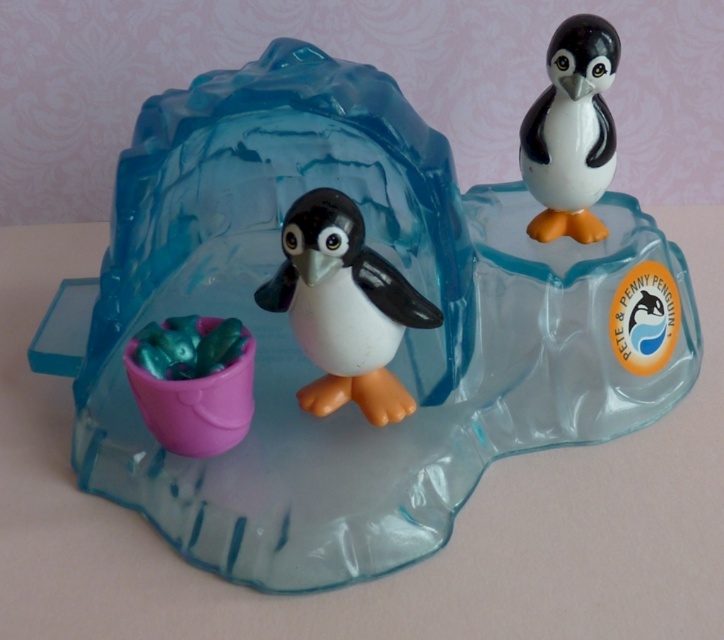
You are a child playing with the toy set and want to place a new penguin between the two points, point (308,285) and point (578,45). Which point should you place the new penguin closer to so that it appears larger in the image?

→ You should place the new penguin closer to point (308,285) because it is closer to the viewer, making objects placed there appear larger in the image.

You are a child trying to reach both the white glossy penguin at center and the smooth glossy penguin at upper right from where you are standing. Which penguin will you reach first?

The white glossy penguin at center is closer to the viewer than the smooth glossy penguin at upper right, so you will reach the white glossy penguin at center first.

You are a child trying to place a third penguin figurine between the white glossy penguin at center and the smooth glossy penguin at upper right. Which penguin should you place the new figurine closer to if you want it to be equidistant from both?

The white glossy penguin at center is wider than the smooth glossy penguin at upper right. To place the new figurine equidistant from both, you should position it closer to the smooth glossy penguin at upper right since it is narrower, allowing more space between the two wider penguins.